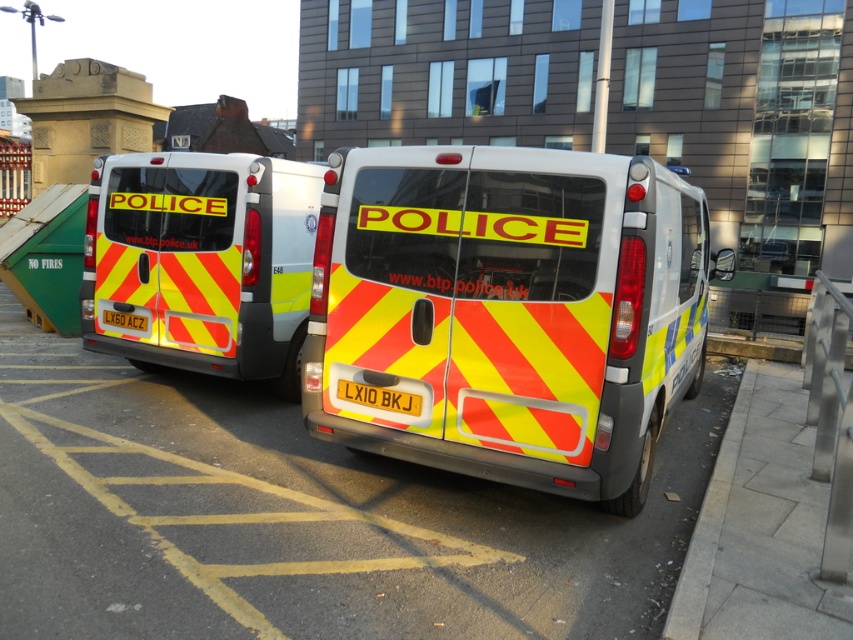
You are a delivery person who needs to park your van in the parking bay marked with yellow lines. The parking bay has a maximum length of 20 feet. You see the yellow reflective material police van at center and the yellow reflective plate at rear center. Can your van fit in the parking bay without overlapping the yellow lines?

The yellow reflective material police van at center is 24.63 inches away from the yellow reflective plate at rear center. Since the parking bay has a maximum length of 20 feet, which is equivalent to 240 inches, the distance between the two objects is well within the allowed length. Therefore, your van can fit in the parking bay without overlapping the yellow lines.

You are a parking attendant checking for vehicles parked over restricted areas. You see the yellow reflective material police van at center and the yellow reflective plate at rear center. Which vehicle is parked over the other?

The yellow reflective material police van at center is positioned over yellow reflective plate at rear center, so the police van is parked over the plate.

You are a parking attendant who needs to ensure that both vehicles fit into a parking bay that is 2.5 meters wide. Given the information about their widths, can both the yellow reflective van at center and the yellow reflective material police van at center be parked side by side within the bay without overlapping?

The yellow reflective van at center is wider than the yellow reflective material police van at center. Since the parking bay is only 2.5 meters wide, it depends on their exact widths. However, without specific measurements, we cannot confirm if they fit together. Please check the exact dimensions of both vehicles.